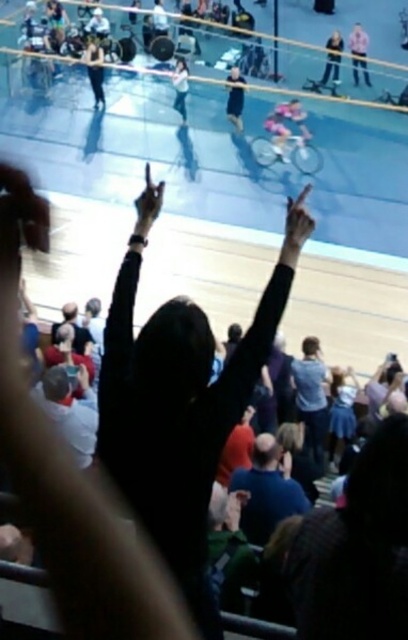
Between light blue fabric at center and matte black tank top at upper left, which one is positioned lower?

light blue fabric at center is below.

Is light blue fabric at center closer to the viewer compared to matte black tank top at upper left?

Yes.

Describe the element at coordinates (286, 128) in the screenshot. I see `light blue fabric at center` at that location.

At what (x,y) coordinates should I click in order to perform the action: click on light blue fabric at center. Please return your answer as a coordinate pair (x, y). Looking at the image, I should click on (286, 128).

Can you confirm if matte black tank top at upper left is positioned to the left of light blue shirt at center?

Indeed, matte black tank top at upper left is positioned on the left side of light blue shirt at center.

From the picture: Can you confirm if matte black tank top at upper left is bigger than light blue shirt at center?

Yes.

Who is more forward, (101, 52) or (177, 96)?

Point (177, 96)

At what (x,y) coordinates should I click in order to perform the action: click on matte black tank top at upper left. Please return your answer as a coordinate pair (x, y). This screenshot has height=640, width=408. Looking at the image, I should click on (95, 68).

Is blue denim shirt at center to the right of light blue shirt at center from the viewer's perspective?

Indeed, blue denim shirt at center is positioned on the right side of light blue shirt at center.

Between point (321, 445) and point (186, 81), which one is positioned behind?

The point (186, 81) is more distant.

Measure the distance between blue denim shirt at center and camera.

blue denim shirt at center is 11.21 meters away from camera.

Identify the location of blue denim shirt at center. Image resolution: width=408 pixels, height=640 pixels. (312, 397).